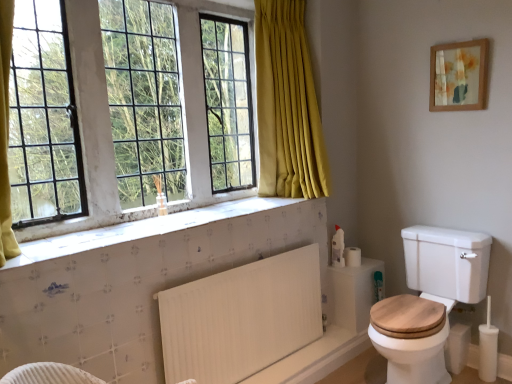
Find the location of a particular element. The width and height of the screenshot is (512, 384). spots to the right of white matte toilet paper at right is located at coordinates (371, 261).